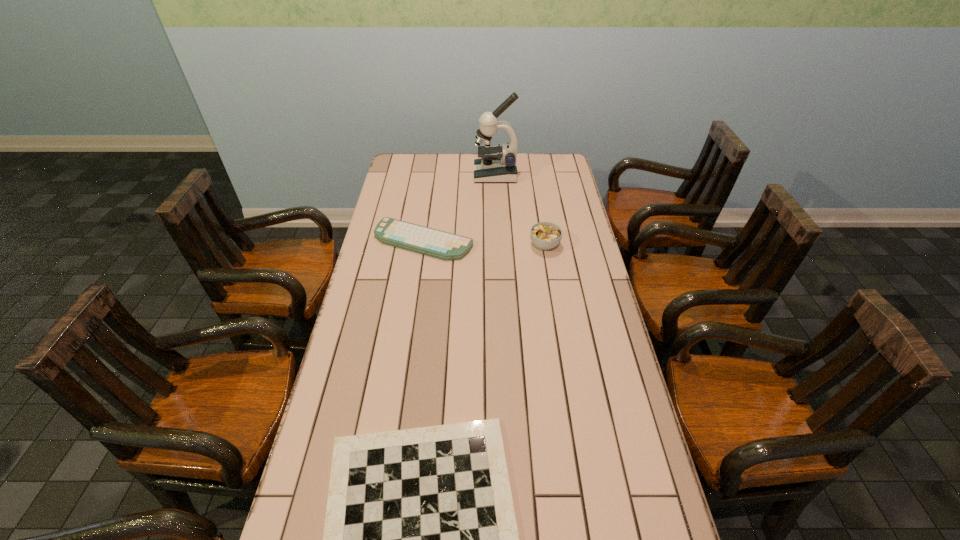
Find the location of a particular element. This screenshot has width=960, height=540. vacant space that's between the farthest object and the rightmost object is located at coordinates (520, 210).

At what (x,y) coordinates should I click in order to perform the action: click on vacant area between the soup bowl and the tallest object. Please return your answer as a coordinate pair (x, y). Looking at the image, I should click on (520, 210).

Locate an element on the screen. object that is the second closest to the computer keyboard is located at coordinates (497, 163).

The image size is (960, 540). In order to click on the third closest object to the rightmost object in this screenshot , I will do `click(420, 539)`.